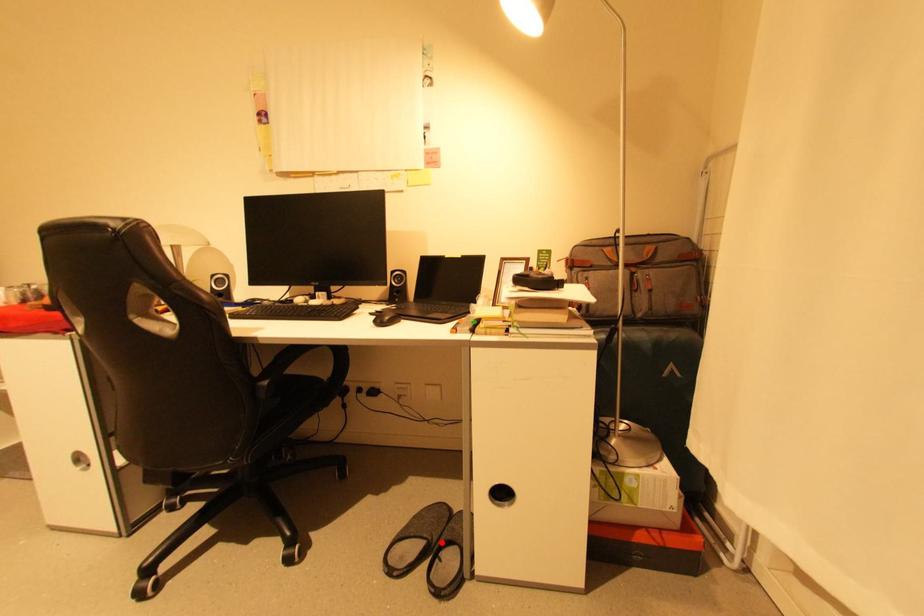
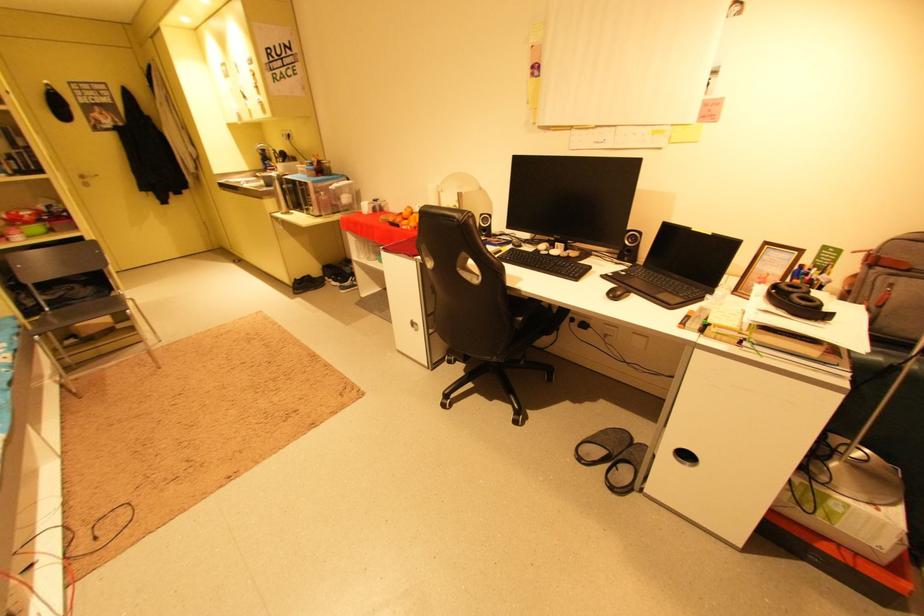
Where in the second image is the point corresponding to the highlighted location from the first image?

(623, 456)